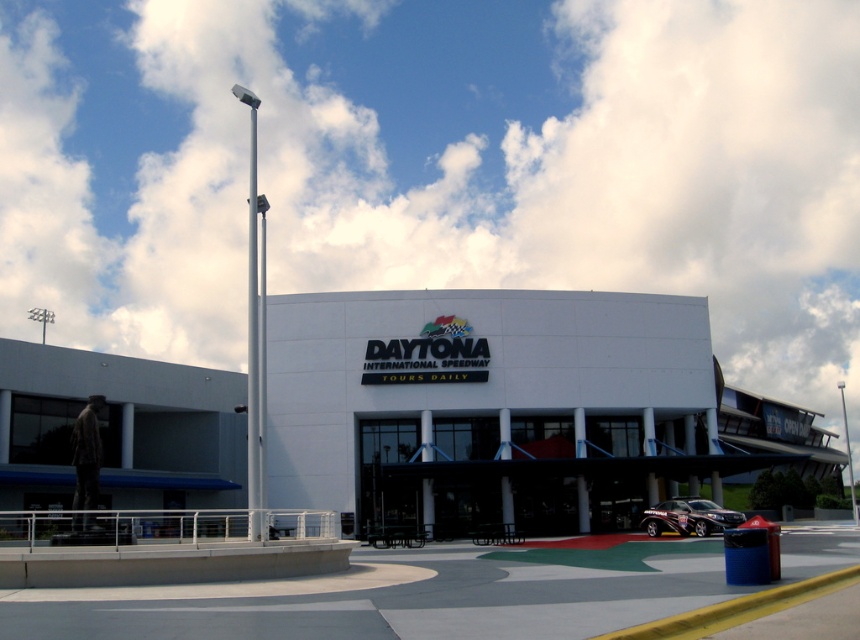
Question: Is white smooth building at center to the left of metallic flag pole at right from the viewer's perspective?

Choices:
 (A) no
 (B) yes

Answer: (B)

Question: Among these points, which one is nearest to the camera?

Choices:
 (A) (634, 454)
 (B) (707, 529)
 (C) (842, 404)

Answer: (B)

Question: Which object is positioned closest to the metallic flag pole at right?

Choices:
 (A) white smooth building at center
 (B) shiny metallic car at lower right

Answer: (A)

Question: Which object is the closest to the shiny metallic car at lower right?

Choices:
 (A) white smooth building at center
 (B) metallic flag pole at right

Answer: (A)

Question: Does white smooth building at center appear under metallic flag pole at right?

Choices:
 (A) yes
 (B) no

Answer: (B)

Question: Does white smooth building at center appear over shiny metallic car at lower right?

Choices:
 (A) yes
 (B) no

Answer: (A)